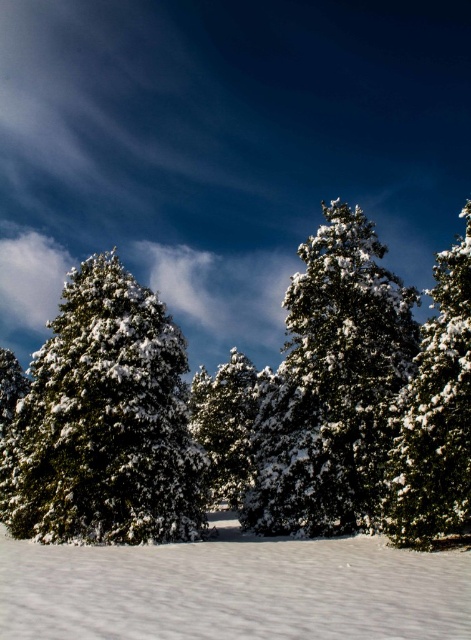
Question: Observing the image, what is the correct spatial positioning of green matte tree at left in reference to green matte tree at right?

Choices:
 (A) above
 (B) below

Answer: (B)

Question: Which object appears farthest from the camera in this image?

Choices:
 (A) green matte tree at left
 (B) green matte tree at right

Answer: (A)

Question: Is green matte tree at left positioned behind green matte tree at right?

Choices:
 (A) no
 (B) yes

Answer: (B)

Question: Based on their relative distances, which object is nearer to the green matte tree at left?

Choices:
 (A) white snow at lower center
 (B) green matte tree at center
 (C) green textured pine tree at center
 (D) green matte tree at right

Answer: (A)

Question: Which of the following is the farthest from the observer?

Choices:
 (A) (314, 264)
 (B) (34, 516)
 (C) (389, 508)
 (D) (127, 579)

Answer: (A)

Question: Is green matte tree at center positioned behind green textured pine tree at center?

Choices:
 (A) no
 (B) yes

Answer: (A)